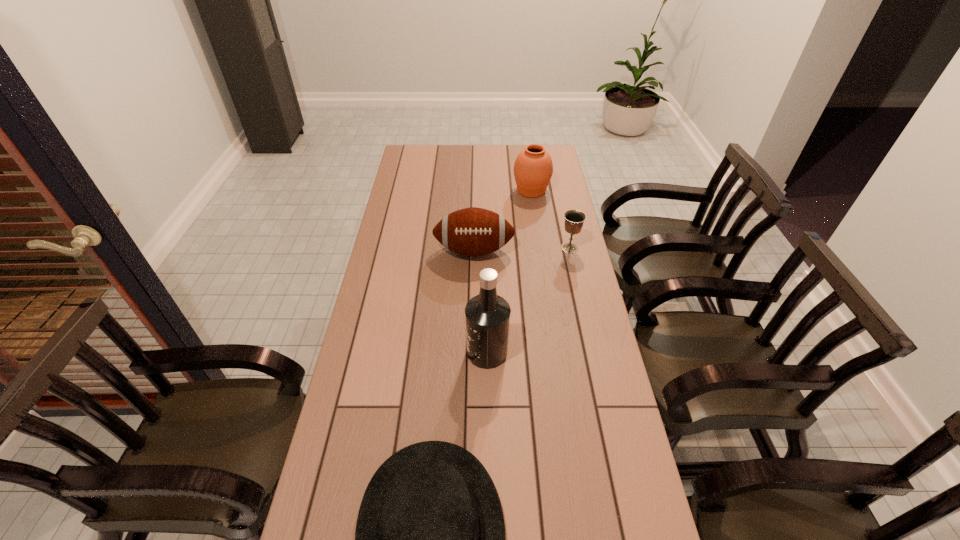
At what (x,y) coordinates should I click in order to perform the action: click on liquor. Please return your answer as a coordinate pair (x, y). The height and width of the screenshot is (540, 960). Looking at the image, I should click on coord(487,315).

This screenshot has height=540, width=960. I want to click on the second nearest object, so click(x=487, y=315).

Where is `the farthest object`? The width and height of the screenshot is (960, 540). the farthest object is located at coordinates click(x=533, y=168).

Where is `football`? The width and height of the screenshot is (960, 540). football is located at coordinates (473, 231).

In order to click on the second shortest object in this screenshot , I will do `click(574, 219)`.

Find the location of a particular element. This screenshot has width=960, height=540. vacant space located 0.220m on the front label of the tallest object is located at coordinates pos(392,352).

Locate an element on the screen. The width and height of the screenshot is (960, 540). vacant region located on the front label of the tallest object is located at coordinates (398, 352).

Where is `free space located 0.130m on the front label of the tallest object`? Image resolution: width=960 pixels, height=540 pixels. free space located 0.130m on the front label of the tallest object is located at coordinates (422, 352).

Locate an element on the screen. The height and width of the screenshot is (540, 960). vacant space located on the front of the farthest object is located at coordinates (542, 264).

Locate an element on the screen. This screenshot has width=960, height=540. blank space located on the laces of the football is located at coordinates (473, 293).